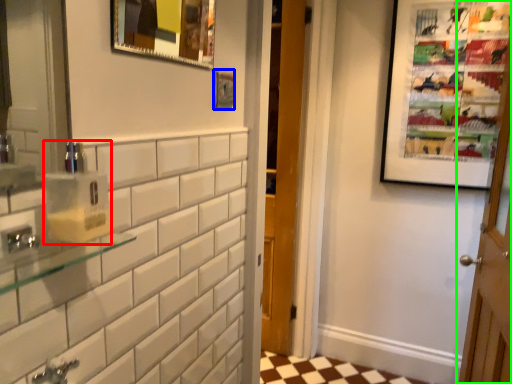
Question: Which is nearer to the soap dispenser (highlighted by a red box)? picture frame (highlighted by a blue box) or door (highlighted by a green box).

Choices:
 (A) picture frame
 (B) door

Answer: (A)